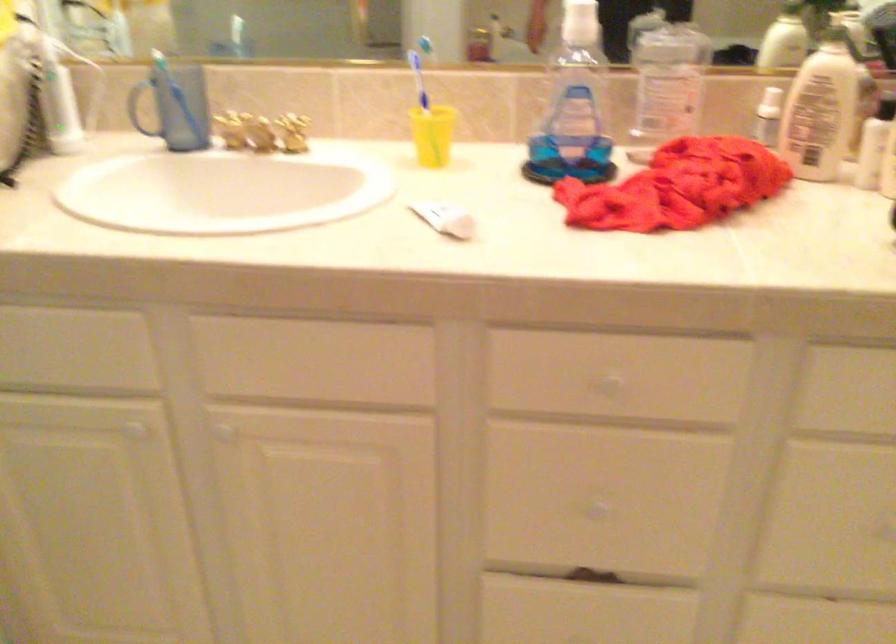
Find where to push the pump dispenser head. Please return your answer as a coordinate pair (x, y).

(583, 24)